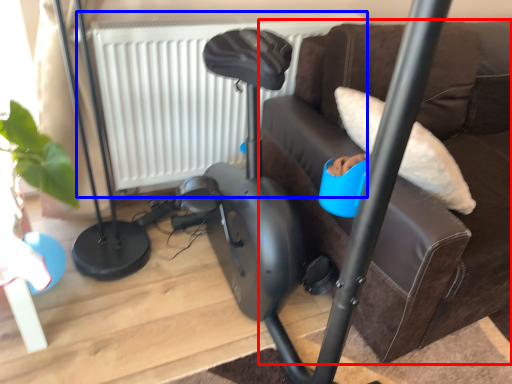
Question: Among these objects, which one is farthest to the camera, furniture (highlighted by a red box) or radiator (highlighted by a blue box)?

Choices:
 (A) furniture
 (B) radiator

Answer: (B)